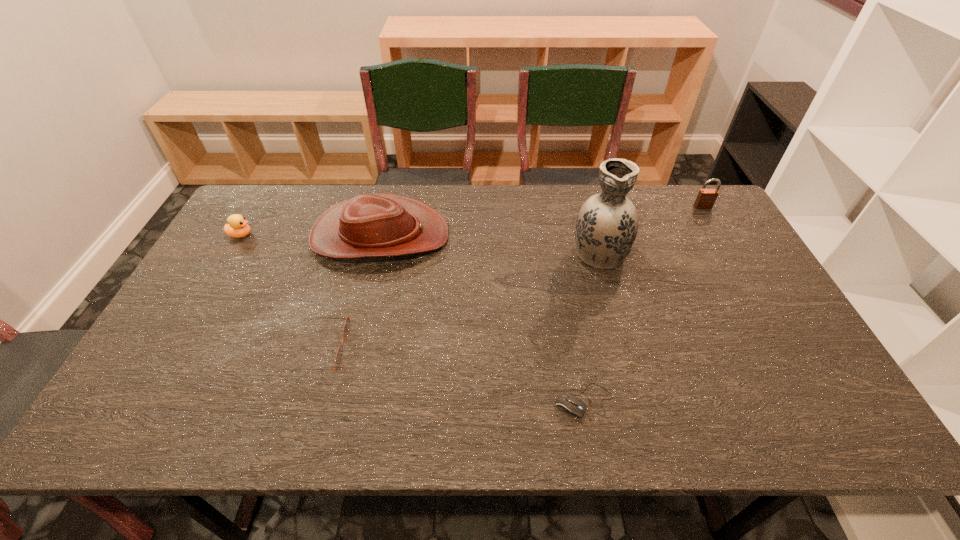
This screenshot has width=960, height=540. What are the coordinates of `vase` in the screenshot? It's located at (606, 227).

Find the location of a particular element. The height and width of the screenshot is (540, 960). cowboy hat is located at coordinates (369, 225).

Locate an element on the screen. the rightmost object is located at coordinates (706, 198).

Locate an element on the screen. Image resolution: width=960 pixels, height=540 pixels. the leftmost object is located at coordinates (237, 227).

At what (x,y) coordinates should I click in order to perform the action: click on duckling. Please return your answer as a coordinate pair (x, y). The image size is (960, 540). Looking at the image, I should click on pyautogui.click(x=237, y=227).

Find the location of `sunglasses`. sunglasses is located at coordinates (339, 355).

At what (x,y) coordinates should I click in order to perform the action: click on the fifth tallest object. Please return your answer as a coordinate pair (x, y). Image resolution: width=960 pixels, height=540 pixels. Looking at the image, I should click on (339, 355).

Where is `the nearest object`? This screenshot has width=960, height=540. the nearest object is located at coordinates (570, 405).

Find the location of a particular element. computer mouse is located at coordinates (570, 405).

Locate an element on the screen. The height and width of the screenshot is (540, 960). blank space located with the handle on the side of the tallest object is located at coordinates (587, 207).